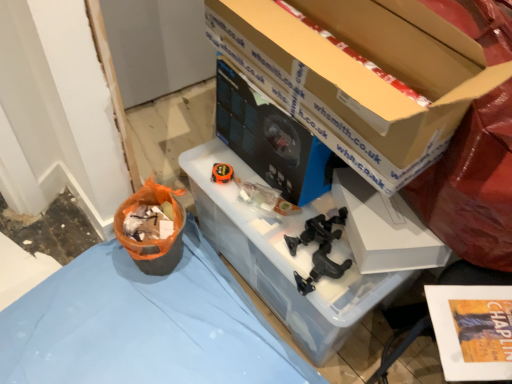
This screenshot has width=512, height=384. I want to click on free space in front of orange rubber tape measure at center, which appears as the 2th toy when viewed from the front, so click(231, 201).